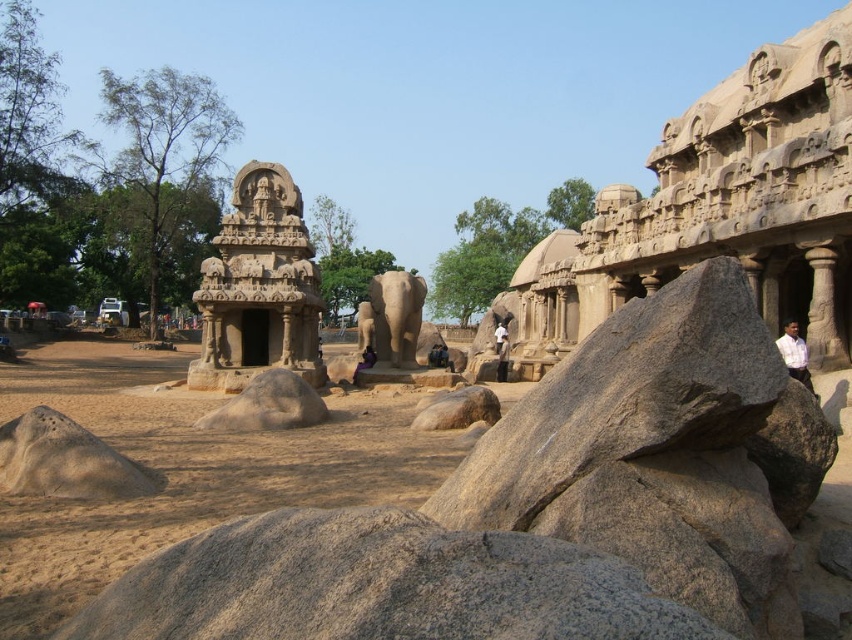
You are standing in front of the ancient rock temple and see a white shirt at center and a purple fabric at center. Which item is closer to you?

The white shirt at center is closer to you because it is further to the viewer than the purple fabric at center.

You are a tourist visiting the ancient rock temples and notice two white shirts in the scene. Which one is nearer to you, the white shirt at right or the white shirt at center?

The white shirt at right is closer to the viewer than the white shirt at center, so the one at the right is nearer.

You are a tourist visiting the ancient temple complex and notice two white shirts left behind. Where is the white shirt at right located in relation to the white shirt at center?

The white shirt at right is located to the right of the white shirt at center.